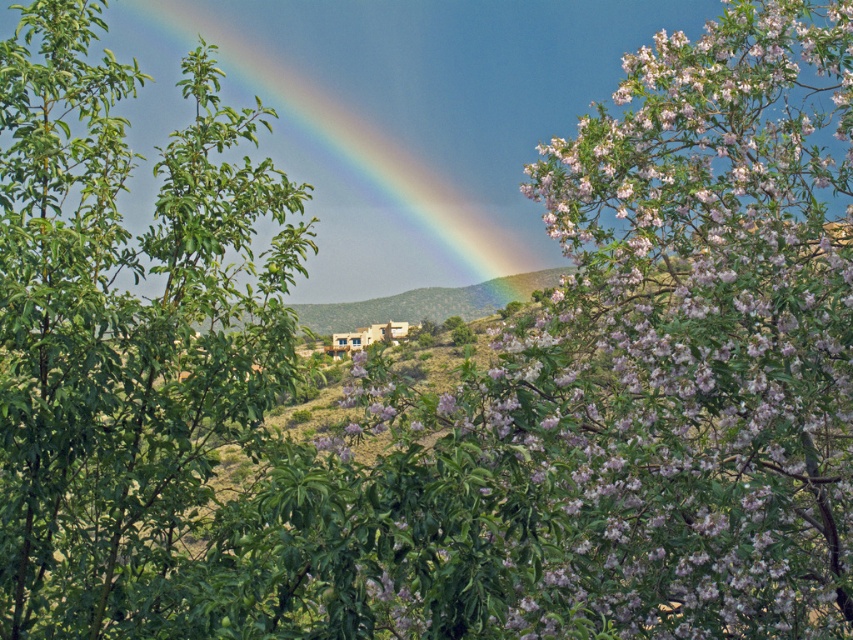
Is green leafy tree at left further to the viewer compared to rainbow at upper center?

No, green leafy tree at left is in front of rainbow at upper center.

Is point (163, 289) positioned before point (527, 13)?

Yes, it is in front of point (527, 13).

Where is `green leafy tree at left`? green leafy tree at left is located at coordinates (125, 333).

Image resolution: width=853 pixels, height=640 pixels. In order to click on green leafy tree at left in this screenshot , I will do `click(125, 333)`.

Is point (820, 131) in front of point (442, 252)?

Yes, it is in front of point (442, 252).

Does point (784, 188) come behind point (483, 262)?

No, it is in front of (483, 262).

Is point (491, 540) farther from camera compared to point (352, 74)?

No.

The width and height of the screenshot is (853, 640). Identify the location of pink bloom at center. (619, 387).

Does pink bloom at center appear under green leafy tree at left?

Yes, pink bloom at center is below green leafy tree at left.

Does pink bloom at center come in front of green leafy tree at left?

Yes, pink bloom at center is closer to the viewer.

Does point (556, 506) come in front of point (247, 186)?

Yes.

This screenshot has height=640, width=853. I want to click on pink bloom at center, so click(x=619, y=387).